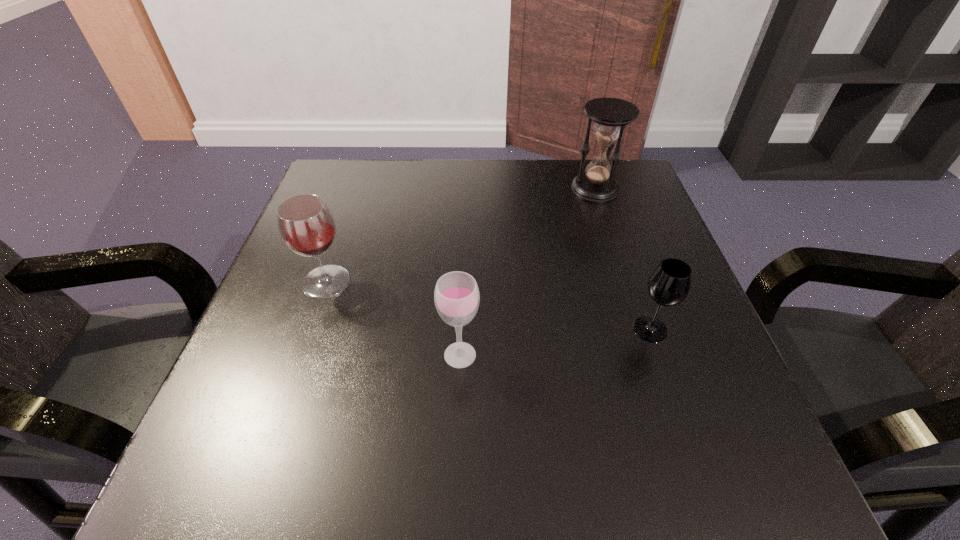
This screenshot has height=540, width=960. I want to click on the farthest object, so click(x=611, y=115).

Locate an element on the screen. the farthest wineglass is located at coordinates (306, 225).

Identify the location of the leftmost object. (306, 225).

You are a GUI agent. You are given a task and a screenshot of the screen. Output one action in this format:
    pyautogui.click(x=<x>, y=<y>)
    Task: Click on the second wineglass from left to right
    The width and height of the screenshot is (960, 540).
    Given the screenshot: What is the action you would take?
    pyautogui.click(x=456, y=296)

Find the location of `the rightmost wineglass`. the rightmost wineglass is located at coordinates (669, 285).

Identify the location of free space located on the front of the farthest object. The height and width of the screenshot is (540, 960). (623, 274).

I want to click on free space located 0.330m on the front of the farthest wineglass, so click(260, 475).

You are a GUI agent. You are given a task and a screenshot of the screen. Output one action in this format:
    pyautogui.click(x=<x>, y=<y>)
    Task: Click on the free spot located 0.380m on the right of the third object from right to left
    The height and width of the screenshot is (540, 960).
    Given the screenshot: What is the action you would take?
    pyautogui.click(x=701, y=355)

Identify the location of vacant space located 0.090m on the back of the rightmost wineglass. Image resolution: width=960 pixels, height=540 pixels. (634, 281).

Where is `object positioned at the far edge`? The height and width of the screenshot is (540, 960). object positioned at the far edge is located at coordinates (611, 115).